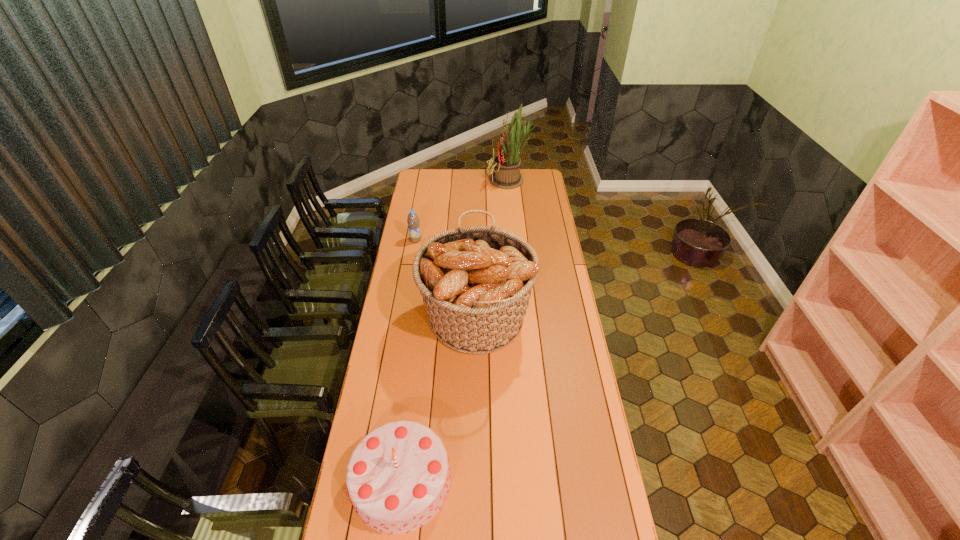
Where is `vacant space at the left edge of the desktop`? The width and height of the screenshot is (960, 540). vacant space at the left edge of the desktop is located at coordinates (416, 205).

Locate an element on the screen. This screenshot has height=540, width=960. vacant space at the right edge of the desktop is located at coordinates (534, 246).

Where is `vacant area at the far left corner of the desktop`? The width and height of the screenshot is (960, 540). vacant area at the far left corner of the desktop is located at coordinates (433, 185).

Where is `vacant area that lies between the water bottle and the tallest object`? The image size is (960, 540). vacant area that lies between the water bottle and the tallest object is located at coordinates (463, 210).

Where is `vacant area between the water bottle and the birthday cake`? vacant area between the water bottle and the birthday cake is located at coordinates (409, 360).

At what (x,y) coordinates should I click in order to perform the action: click on free spot between the birthday cake and the second nearest object. Please return your answer as a coordinate pair (x, y). This screenshot has height=540, width=960. Looking at the image, I should click on (439, 399).

Locate which object ranks second in proximity to the second tallest object. Please provide its 2D coordinates. Your answer should be formatted as a tuple, i.e. [(x, y)], where the tuple contains the x and y coordinates of a point satisfying the conditions above.

[(398, 477)]

Identify the location of object identified as the closest to the shortest object. (476, 282).

Image resolution: width=960 pixels, height=540 pixels. What are the coordinates of `free space that satisfies the following two spatial constraints: 1. on the back side of the third farthest object; 2. on the right side of the birthday cake` in the screenshot? It's located at (422, 317).

Identify the location of vacant region that satisfies the following two spatial constraints: 1. in front of the farthest object with the fan visible; 2. on the front side of the nearest object. point(540,481).